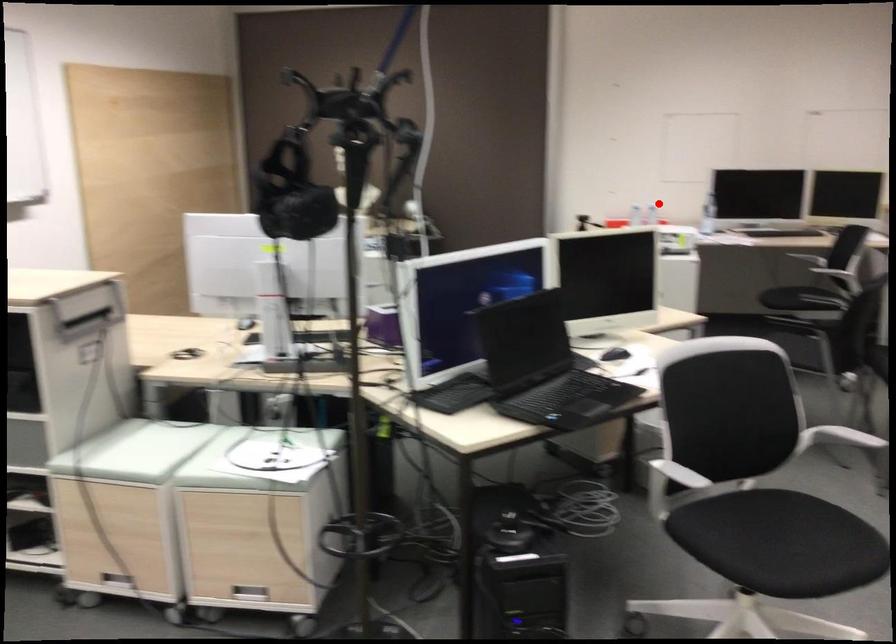
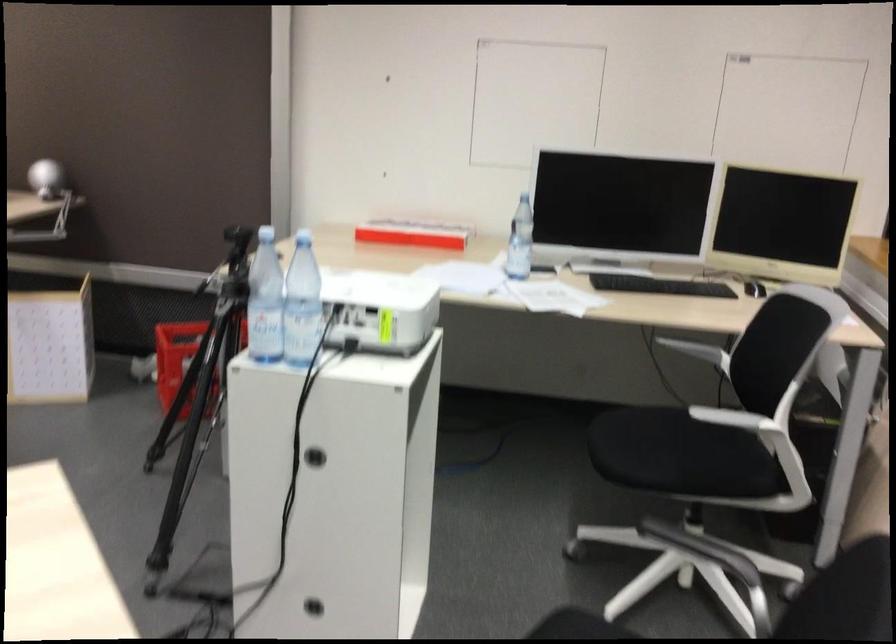
Where in the second image is the point corresponding to the highlighted location from the first image?

(412, 234)